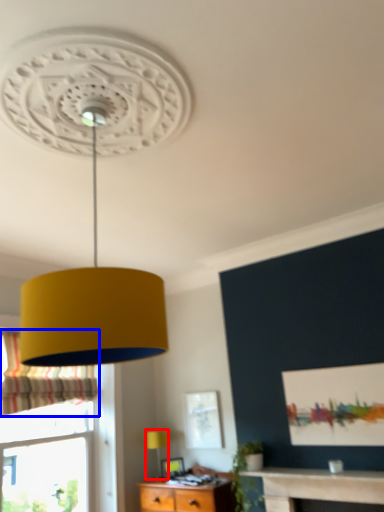
Question: Among these objects, which one is nearest to the camera, table lamp (highlighted by a red box) or curtain (highlighted by a blue box)?

Choices:
 (A) table lamp
 (B) curtain

Answer: (B)